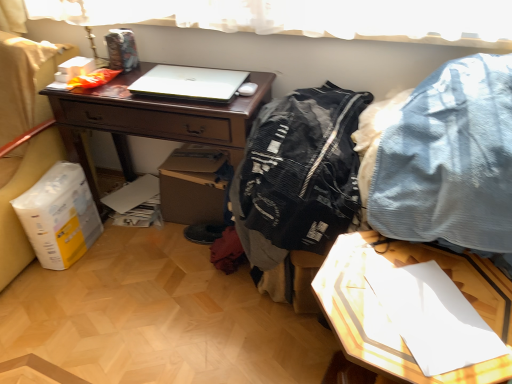
At what (x,y) coordinates should I click in order to perform the action: click on free spot behind white matte laptop at center. Please return your answer as a coordinate pair (x, y). Looking at the image, I should click on (189, 67).